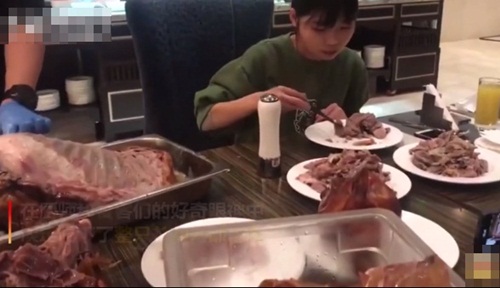
I want to click on fork, so click(x=321, y=114).